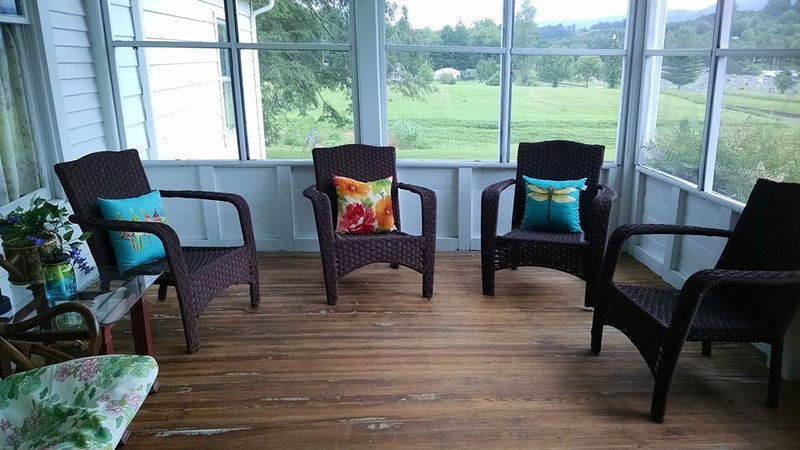
Where is `chairs`? chairs is located at coordinates (545, 183).